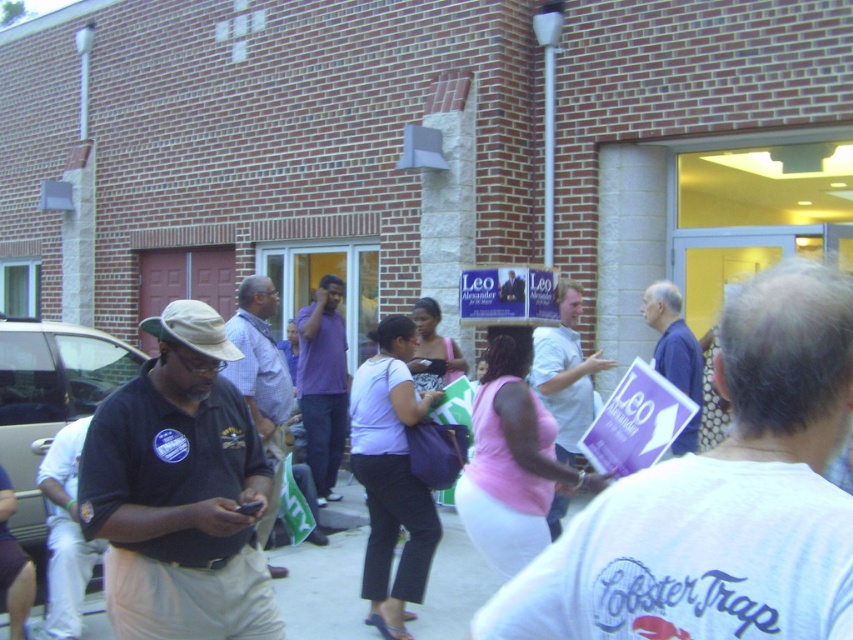
Question: Which object is closer to the camera taking this photo?

Choices:
 (A) purple paper at center
 (B) dark blue polo shirt at left
 (C) light brown shirt at center
 (D) purple paper sign at center

Answer: (D)

Question: Which object is closer to the camera taking this photo?

Choices:
 (A) purple paper sign at center
 (B) purple matte shirt at center
 (C) purple paper at center

Answer: (A)

Question: Does white cotton shirt at center appear under purple paper at center?

Choices:
 (A) no
 (B) yes

Answer: (A)

Question: Considering the relative positions of purple paper sign at center and light brown shirt at center in the image provided, where is purple paper sign at center located with respect to light brown shirt at center?

Choices:
 (A) right
 (B) left

Answer: (A)

Question: Where is white cotton shirt at center located in relation to blue paper sign at center in the image?

Choices:
 (A) below
 (B) above

Answer: (A)

Question: Which point is farther from the camera taking this photo?

Choices:
 (A) (166, 492)
 (B) (331, 285)
 (C) (601, 355)

Answer: (B)